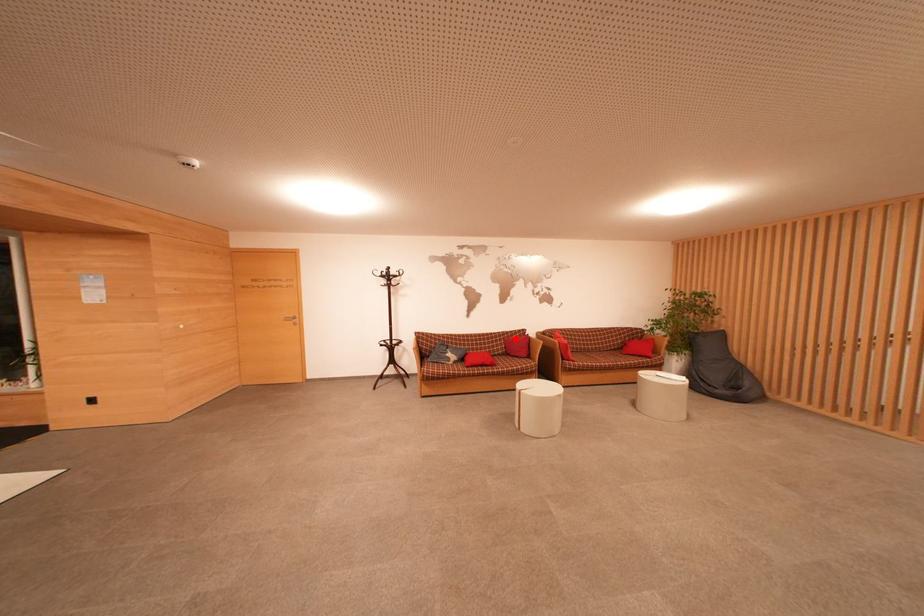
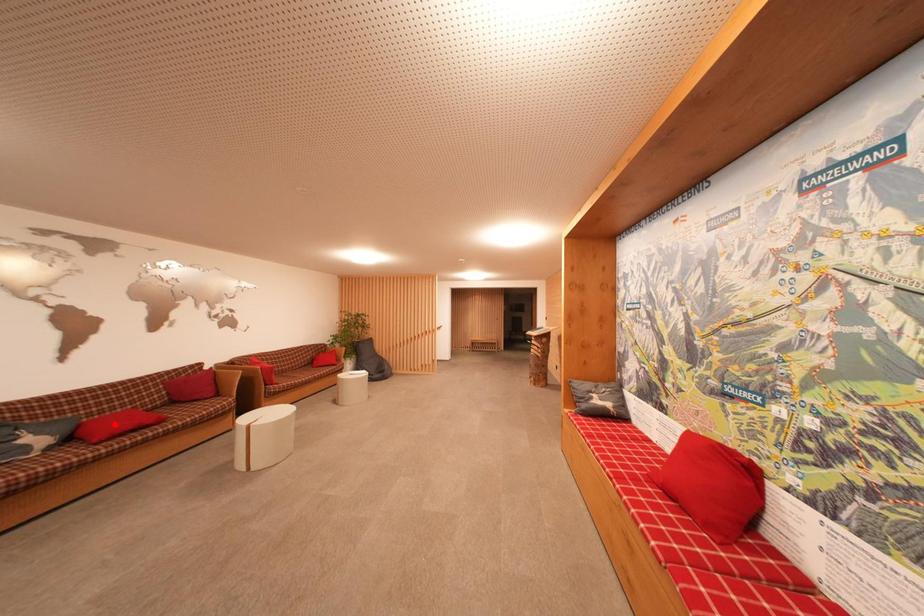
I am providing you with two images of the same scene from different viewpoints. A red point is marked on the first image and another point is marked on the second image. Is the marked point in image1 the same physical position as the marked point in image2?

No